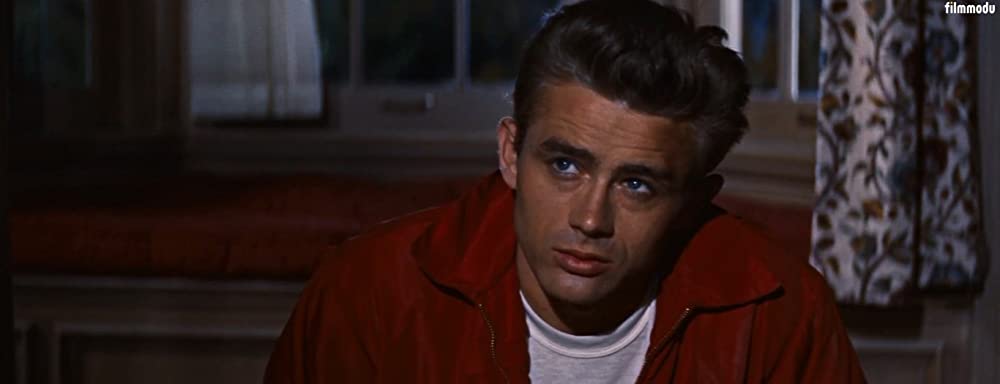
Locate an element on the screen. This screenshot has width=1000, height=384. stairs is located at coordinates (264, 265).